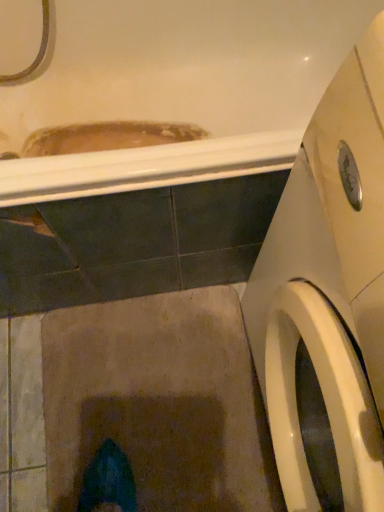
This screenshot has height=512, width=384. Describe the element at coordinates (311, 350) in the screenshot. I see `white glossy washing machine at right` at that location.

What is the approximate height of white glossy washing machine at right?

It is 32.80 inches.

Where is `white glossy washing machine at right`? white glossy washing machine at right is located at coordinates (311, 350).

Find the location of a particular element. This screenshot has height=512, width=384. white glossy bathtub at upper center is located at coordinates (176, 88).

The width and height of the screenshot is (384, 512). What do you see at coordinates (176, 88) in the screenshot? I see `white glossy bathtub at upper center` at bounding box center [176, 88].

Identify the location of white glossy washing machine at right. (311, 350).

Is white glossy washing machine at right at the left side of white glossy bathtub at upper center?

No, white glossy washing machine at right is not to the left of white glossy bathtub at upper center.

Which object is more forward, white glossy washing machine at right or white glossy bathtub at upper center?

white glossy washing machine at right is more forward.

Which point is more distant from viewer, [282,400] or [71,22]?

Positioned behind is point [71,22].

From the image's perspective, which one is positioned higher, white glossy washing machine at right or white glossy bathtub at upper center?

white glossy bathtub at upper center is shown above in the image.

From a real-world perspective, which object stands above the other?

In real-world perspective, white glossy washing machine at right is above.

Considering the sizes of objects white glossy washing machine at right and white glossy bathtub at upper center in the image provided, who is thinner, white glossy washing machine at right or white glossy bathtub at upper center?

white glossy washing machine at right.

Considering the sizes of white glossy washing machine at right and white glossy bathtub at upper center in the image, is white glossy washing machine at right taller or shorter than white glossy bathtub at upper center?

Considering their sizes, white glossy washing machine at right has more height than white glossy bathtub at upper center.

Is white glossy washing machine at right smaller than white glossy bathtub at upper center?

Correct, white glossy washing machine at right occupies less space than white glossy bathtub at upper center.

Would you say white glossy washing machine at right is inside or outside white glossy bathtub at upper center?

white glossy washing machine at right lies outside white glossy bathtub at upper center.

Is white glossy washing machine at right not near white glossy bathtub at upper center?

No, white glossy washing machine at right is not far away from white glossy bathtub at upper center.

Could you tell me if white glossy washing machine at right is turned towards white glossy bathtub at upper center?

No, white glossy washing machine at right is not turned towards white glossy bathtub at upper center.

How different are the orientations of white glossy washing machine at right and white glossy bathtub at upper center in degrees?

The angle between the facing direction of white glossy washing machine at right and the facing direction of white glossy bathtub at upper center is 88.4 degrees.

Identify the location of washing machine in front of the white glossy bathtub at upper center. click(311, 350).

Visually, is white glossy bathtub at upper center positioned to the left or to the right of white glossy washing machine at right?

Clearly, white glossy bathtub at upper center is on the left of white glossy washing machine at right in the image.

Who is more distant, white glossy bathtub at upper center or white glossy washing machine at right?

white glossy bathtub at upper center.

Looking at this image, which is further, (286, 135) or (293, 234)?

The point (286, 135) is farther.

Based on the photo, from the image's perspective, is white glossy bathtub at upper center positioned above or below white glossy washing machine at right?

white glossy bathtub at upper center is situated higher than white glossy washing machine at right in the image.

From a real-world perspective, between white glossy bathtub at upper center and white glossy washing machine at right, who is vertically higher?

In real-world perspective, white glossy washing machine at right is above.

Looking at their sizes, would you say white glossy bathtub at upper center is wider or thinner than white glossy washing machine at right?

In the image, white glossy bathtub at upper center appears to be wider than white glossy washing machine at right.

Who is taller, white glossy bathtub at upper center or white glossy washing machine at right?

Standing taller between the two is white glossy washing machine at right.

Who is bigger, white glossy bathtub at upper center or white glossy washing machine at right?

With larger size is white glossy bathtub at upper center.

Choose the correct answer: Is white glossy bathtub at upper center inside white glossy washing machine at right or outside it?

white glossy bathtub at upper center is not inside white glossy washing machine at right, it's outside.

Is white glossy bathtub at upper center not close to white glossy washing machine at right?

No.

Is white glossy bathtub at upper center turned away from white glossy washing machine at right?

That's not correct — white glossy bathtub at upper center is not looking away from white glossy washing machine at right.

Locate an element on the screen. The height and width of the screenshot is (512, 384). washing machine located on the right of white glossy bathtub at upper center is located at coordinates (311, 350).

The width and height of the screenshot is (384, 512). What are the coordinates of `washing machine below the white glossy bathtub at upper center (from the image's perspective)` in the screenshot? It's located at (311, 350).

Where is `bath that is under the white glossy washing machine at right (from a real-world perspective)`? This screenshot has height=512, width=384. bath that is under the white glossy washing machine at right (from a real-world perspective) is located at coordinates (176, 88).